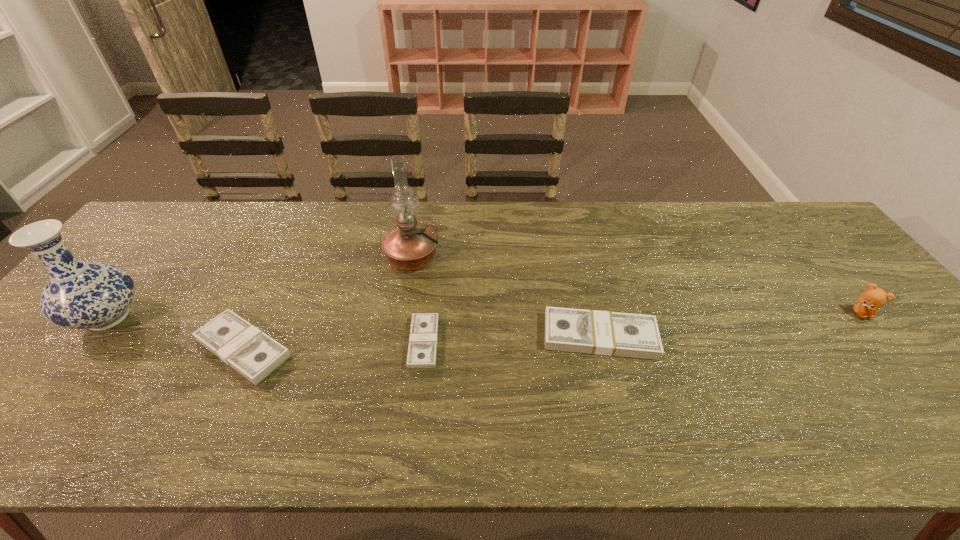
This screenshot has width=960, height=540. In order to click on free point that keeps the dollars evenly spaced on the right in this screenshot , I will do `click(772, 330)`.